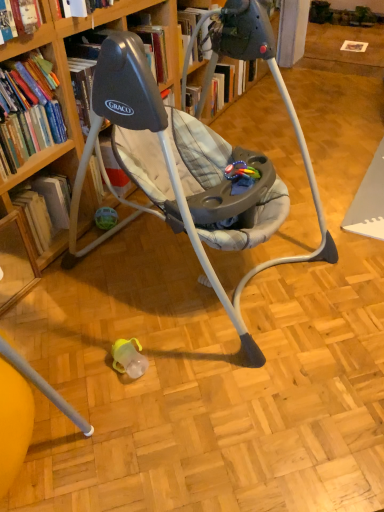
The width and height of the screenshot is (384, 512). In order to click on vacant space underneath wooden bookcase at upper left (from a real-world perspective) in this screenshot , I will do `click(197, 268)`.